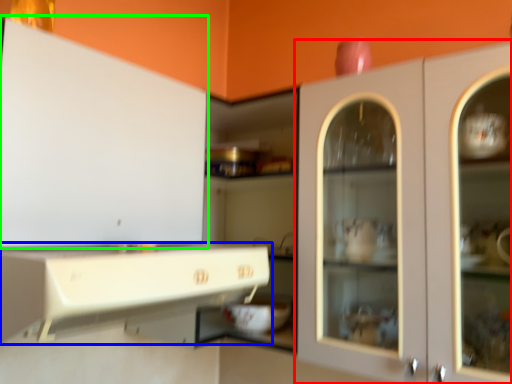
Question: Which object is positioned closest to cabinetry (highlighted by a red box)? Select from cabinetry (highlighted by a blue box) and cabinetry (highlighted by a green box).

Choices:
 (A) cabinetry
 (B) cabinetry

Answer: (A)